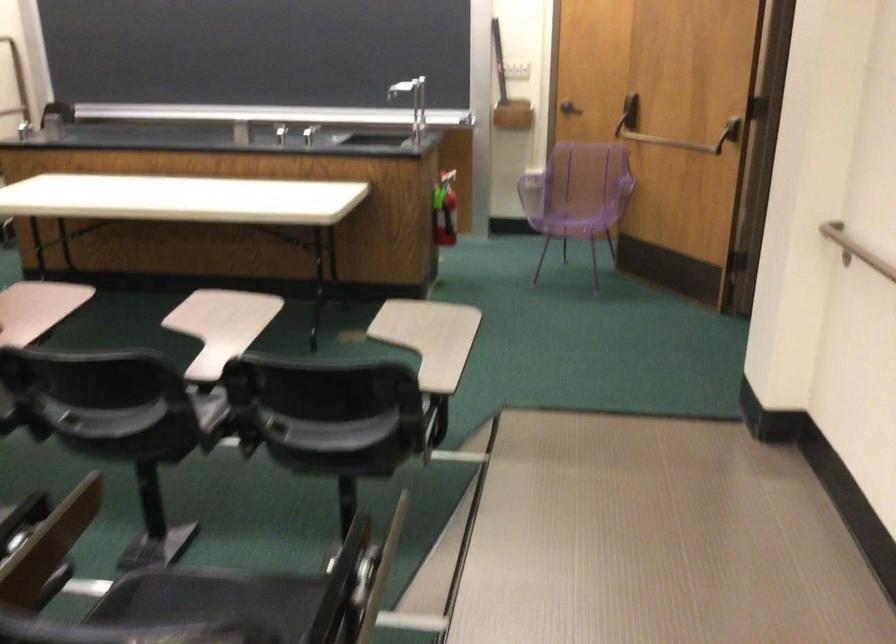
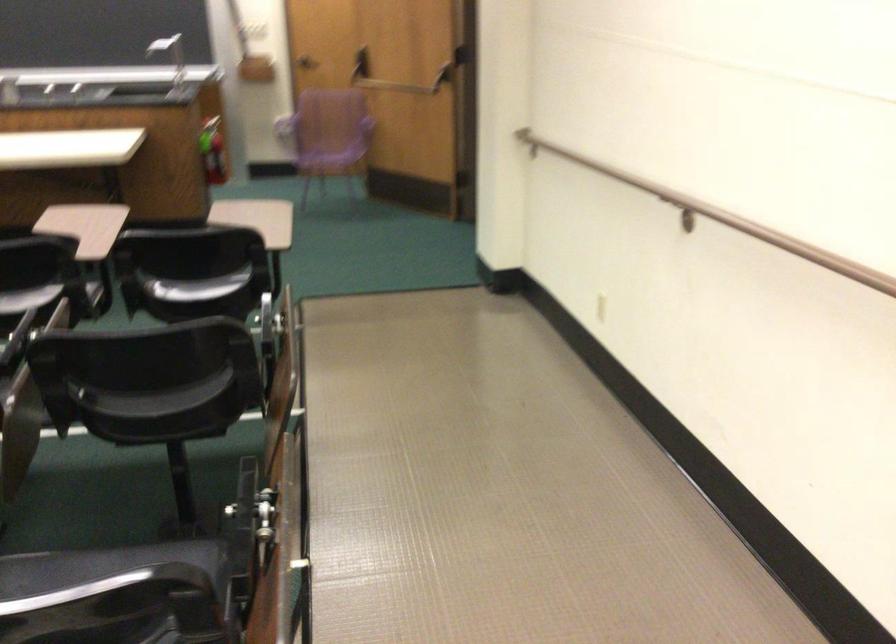
Find the pixel in the second image that matches point 727,128 in the first image.

(444, 78)